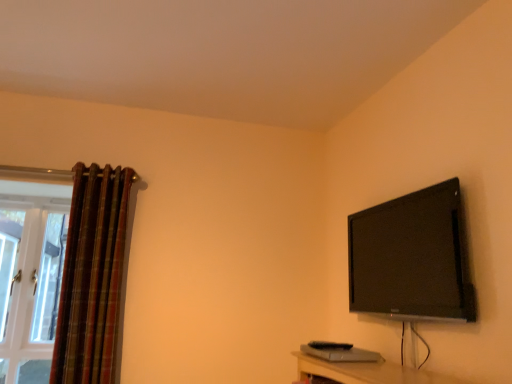
Question: In terms of size, does white glass door at left appear bigger or smaller than plaid fabric curtain at left?

Choices:
 (A) small
 (B) big

Answer: (A)

Question: From a real-world perspective, is white glass door at left positioned above or below plaid fabric curtain at left?

Choices:
 (A) below
 (B) above

Answer: (A)

Question: Estimate the real-world distances between objects in this image. Which object is closer to the black glossy tv at upper right?

Choices:
 (A) plaid fabric curtain at left
 (B) white glass door at left

Answer: (A)

Question: Considering the real-world distances, which object is closest to the plaid fabric curtain at left?

Choices:
 (A) black glossy tv at upper right
 (B) white glass door at left

Answer: (B)